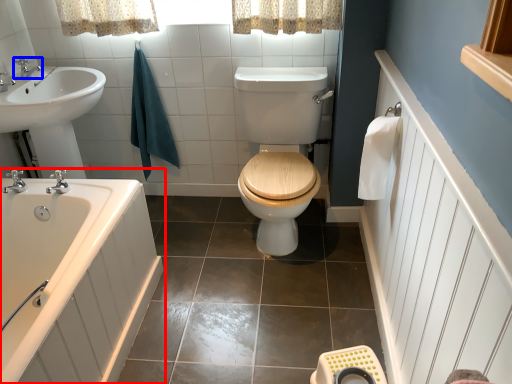
Question: Among these objects, which one is nearest to the camera, bathtub (highlighted by a red box) or tap (highlighted by a blue box)?

Choices:
 (A) bathtub
 (B) tap

Answer: (A)